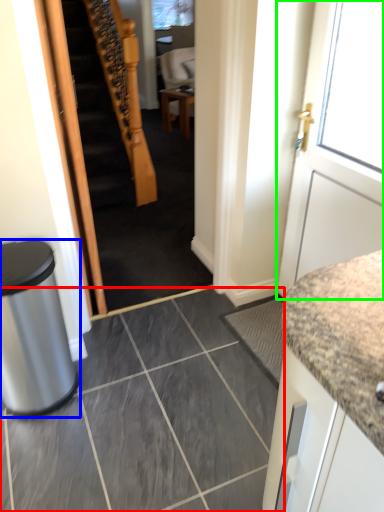
Question: Considering the real-world distances, which object is closest to ceramic tile (highlighted by a red box)? trash bin/can (highlighted by a blue box) or door (highlighted by a green box).

Choices:
 (A) trash bin/can
 (B) door

Answer: (A)